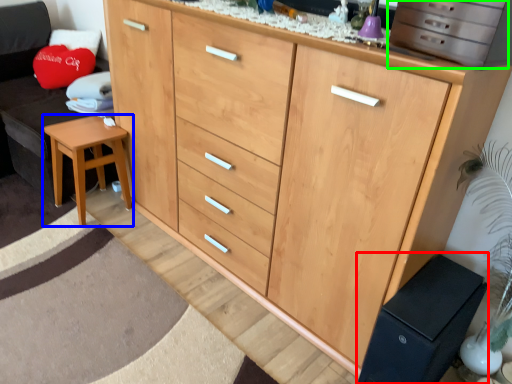
Question: Based on their relative distances, which object is nearer to changing table (highlighted by a red box)? Choose from stool (highlighted by a blue box) and cabinetry (highlighted by a green box).

Choices:
 (A) stool
 (B) cabinetry

Answer: (B)